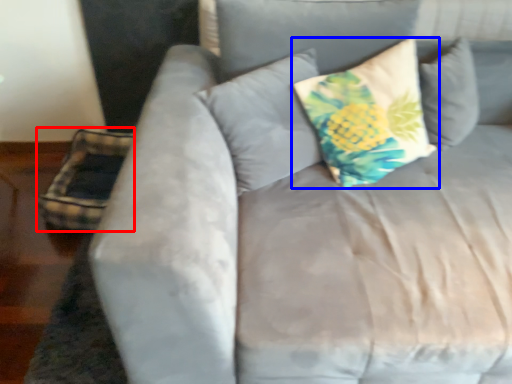
Question: Which of the following is the farthest to the observer, pillow (highlighted by a red box) or pillow (highlighted by a blue box)?

Choices:
 (A) pillow
 (B) pillow

Answer: (A)